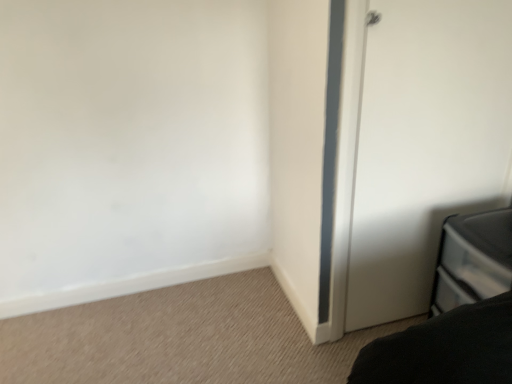
What is the approximate height of black plastic drawer at lower right?

black plastic drawer at lower right is 21.02 inches in height.

What do you see at coordinates (473, 259) in the screenshot? I see `black plastic drawer at lower right` at bounding box center [473, 259].

Find the location of a particular element. This screenshot has height=384, width=512. black plastic drawer at lower right is located at coordinates (473, 259).

Identify the location of white matte door at right. (425, 144).

What do you see at coordinates (425, 144) in the screenshot? The image size is (512, 384). I see `white matte door at right` at bounding box center [425, 144].

In order to face white matte door at right, should I rotate leftwards or rightwards?

It's best to rotate right around 22.885 degrees.

Find the location of `black plastic drawer at lower right`. black plastic drawer at lower right is located at coordinates (473, 259).

Considering the positions of objects black plastic drawer at lower right and white matte door at right in the image provided, who is more to the left, black plastic drawer at lower right or white matte door at right?

white matte door at right.

Considering their positions, is black plastic drawer at lower right located in front of or behind white matte door at right?

Visually, black plastic drawer at lower right is located in front of white matte door at right.

Does point (498, 229) appear closer or farther from the camera than point (464, 197)?

Point (498, 229) appears to be closer to the viewer than point (464, 197).

From the image's perspective, is black plastic drawer at lower right located beneath white matte door at right?

Yes, from the image's perspective, black plastic drawer at lower right is below white matte door at right.

From a real-world perspective, who is located lower, black plastic drawer at lower right or white matte door at right?

From a 3D spatial view, black plastic drawer at lower right is below.

Looking at this image, is black plastic drawer at lower right wider or thinner than white matte door at right?

In the image, black plastic drawer at lower right appears to be wider than white matte door at right.

Does black plastic drawer at lower right have a lesser height compared to white matte door at right?

Correct, black plastic drawer at lower right is not as tall as white matte door at right.

Looking at this image, between black plastic drawer at lower right and white matte door at right, which one has smaller size?

white matte door at right is smaller.

Which is correct: black plastic drawer at lower right is inside white matte door at right, or outside of it?

The correct answer is: outside.

Is black plastic drawer at lower right not close to white matte door at right?

black plastic drawer at lower right is actually quite close to white matte door at right.

Consider the image. Is white matte door at right at the back of black plastic drawer at lower right?

No, black plastic drawer at lower right is not facing the opposite direction of white matte door at right.

How different are the orientations of black plastic drawer at lower right and white matte door at right in degrees?

93.4 degrees.

How far apart are black plastic drawer at lower right and white matte door at right?

They are 12.99 inches apart.

The height and width of the screenshot is (384, 512). Find the location of `furniture that is on the right side of white matte door at right`. furniture that is on the right side of white matte door at right is located at coordinates (x=473, y=259).

Between white matte door at right and black plastic drawer at lower right, which one appears on the right side from the viewer's perspective?

black plastic drawer at lower right is more to the right.

Considering the positions of objects white matte door at right and black plastic drawer at lower right in the image provided, who is behind, white matte door at right or black plastic drawer at lower right?

white matte door at right is behind.

Is point (472, 197) closer or farther from the camera than point (447, 288)?

Point (472, 197).

From the image's perspective, is white matte door at right over black plastic drawer at lower right?

Indeed, from the image's perspective, white matte door at right is shown above black plastic drawer at lower right.

From a real-world perspective, relative to black plastic drawer at lower right, is white matte door at right vertically above or below?

white matte door at right is above black plastic drawer at lower right.

Is white matte door at right thinner than black plastic drawer at lower right?

Yes.

Can you confirm if white matte door at right is shorter than black plastic drawer at lower right?

In fact, white matte door at right may be taller than black plastic drawer at lower right.

Considering the relative sizes of white matte door at right and black plastic drawer at lower right in the image provided, is white matte door at right bigger than black plastic drawer at lower right?

No, white matte door at right is not bigger than black plastic drawer at lower right.

Could black plastic drawer at lower right be considered to be inside white matte door at right?

That's incorrect, black plastic drawer at lower right is not inside white matte door at right.

Based on the photo, would you consider white matte door at right to be distant from black plastic drawer at lower right?

No, white matte door at right is not far away from black plastic drawer at lower right.

Consider the image. Is white matte door at right oriented towards black plastic drawer at lower right?

Yes, white matte door at right is turned towards black plastic drawer at lower right.

This screenshot has width=512, height=384. I want to click on door above the black plastic drawer at lower right (from a real-world perspective), so click(425, 144).

You are a GUI agent. You are given a task and a screenshot of the screen. Output one action in this format:
    pyautogui.click(x=<x>, y=<y>)
    Task: Click on the door above the black plastic drawer at lower right (from the image's perspective)
    
    Given the screenshot: What is the action you would take?
    pyautogui.click(x=425, y=144)

Locate an element on the screen. This screenshot has height=384, width=512. door lying behind the black plastic drawer at lower right is located at coordinates (425, 144).